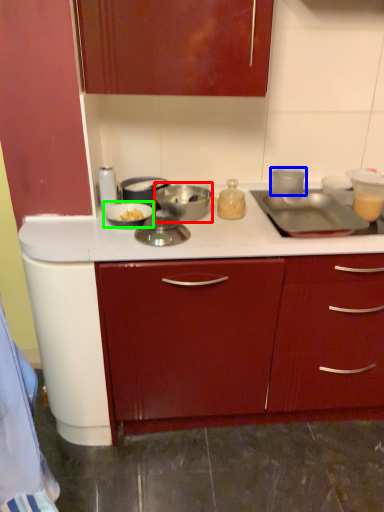
Question: Estimate the real-world distances between objects in this image. Which object is farther from kitchen appliance (highlighted by a red box), kitchen appliance (highlighted by a blue box) or kitchen appliance (highlighted by a green box)?

Choices:
 (A) kitchen appliance
 (B) kitchen appliance

Answer: (A)